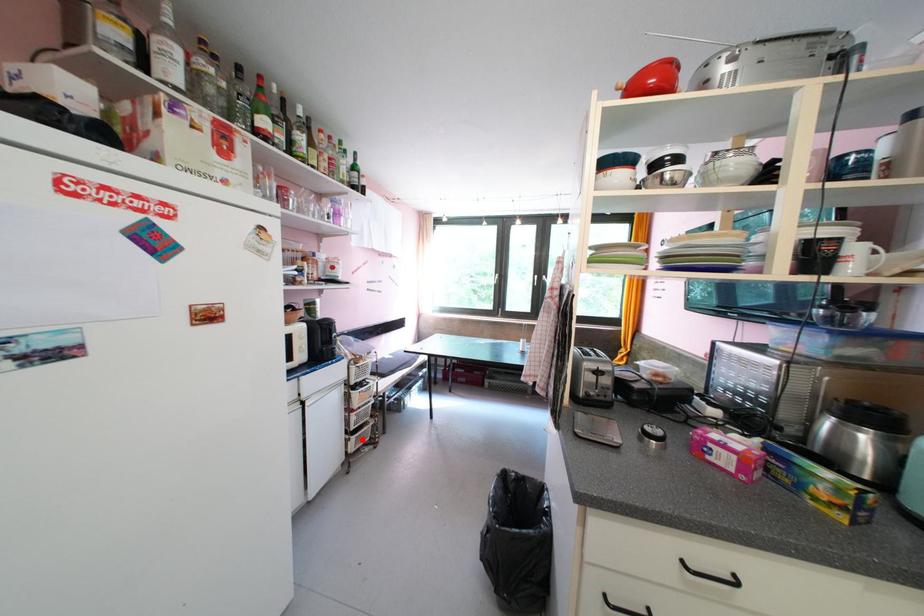
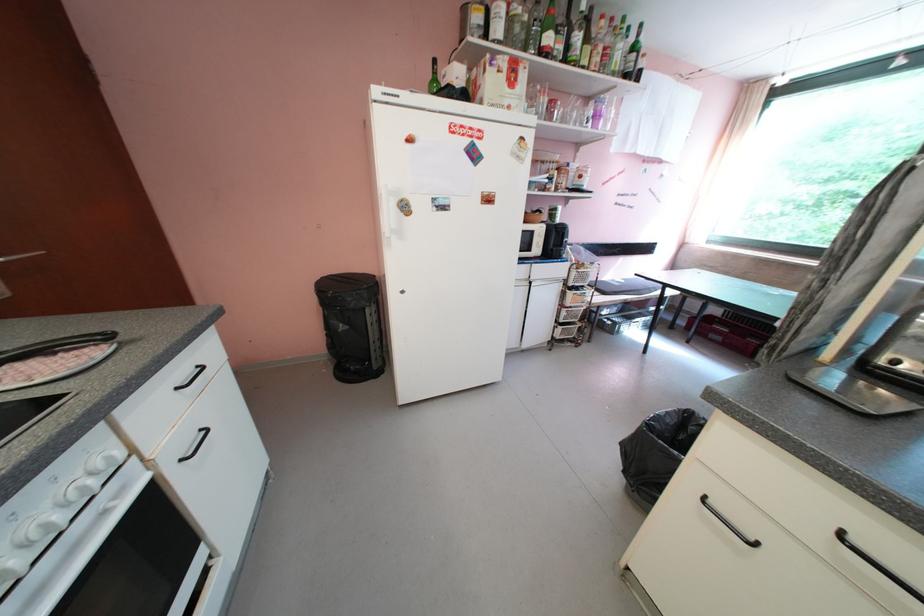
Question: I am providing you with two images of the same scene from different viewpoints. Image1 has a red point marked. In image2, the corresponding 3D location appears at what relative position? Reply with the corresponding letter.

Choices:
 (A) Closer
 (B) Farther

Answer: (A)